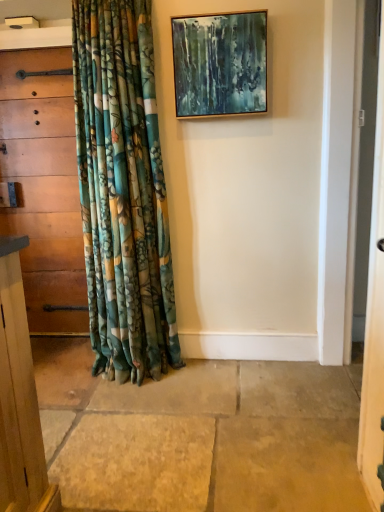
The image size is (384, 512). Find the location of `vacant space situated above wooden chest of drawers at left (from a real-world perspective)`. vacant space situated above wooden chest of drawers at left (from a real-world perspective) is located at coordinates (24, 50).